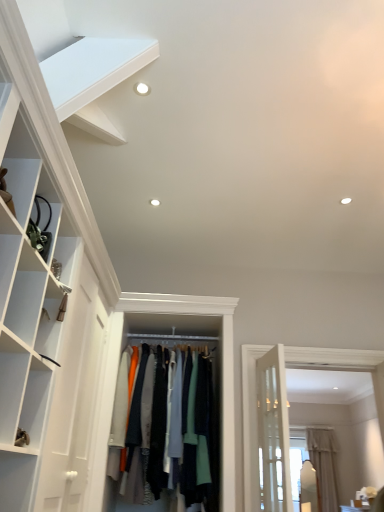
Locate an element on the screen. Image resolution: width=384 pixels, height=512 pixels. knit fabric sweater at center is located at coordinates (195, 431).

This screenshot has width=384, height=512. What are the coordinates of `white matte shelf at upper left` in the screenshot? It's located at (93, 79).

The width and height of the screenshot is (384, 512). What are the coordinates of `knit fabric sweater at center` in the screenshot? It's located at (195, 431).

Is beige fabric curtain at right at the left side of white matte shelf at upper left?

No.

Is point (336, 483) more distant than point (86, 61)?

Yes, point (336, 483) is farther from viewer.

Would you say beige fabric curtain at right contains white matte shelf at upper left?

That's incorrect, white matte shelf at upper left is not inside beige fabric curtain at right.

Between beige fabric curtain at right and white matte shelf at upper left, which one is positioned behind?

beige fabric curtain at right is more distant.

From the image's perspective, between white matte shelf at upper left and beige fabric curtain at right, which one is located above?

From the image's view, white matte shelf at upper left is above.

Where is `curtain behind the white matte shelf at upper left`? curtain behind the white matte shelf at upper left is located at coordinates (324, 466).

Considering the sizes of white matte shelf at upper left and beige fabric curtain at right in the image, is white matte shelf at upper left taller or shorter than beige fabric curtain at right?

Clearly, white matte shelf at upper left is shorter compared to beige fabric curtain at right.

From a real-world perspective, which is physically below, knit fabric sweater at center or beige fabric curtain at right?

From a 3D spatial view, beige fabric curtain at right is below.

Does knit fabric sweater at center have a larger size compared to beige fabric curtain at right?

Yes, knit fabric sweater at center is bigger than beige fabric curtain at right.

Consider the image. Which of these two, knit fabric sweater at center or beige fabric curtain at right, is thinner?

With smaller width is beige fabric curtain at right.

Measure the distance between knit fabric sweater at center and beige fabric curtain at right.

A distance of 4.34 meters exists between knit fabric sweater at center and beige fabric curtain at right.

Which is closer to the camera, (121, 74) or (194, 409)?

Point (121, 74) is positioned closer to the camera compared to point (194, 409).

Considering the relative sizes of white matte shelf at upper left and knit fabric sweater at center in the image provided, is white matte shelf at upper left taller than knit fabric sweater at center?

In fact, white matte shelf at upper left may be shorter than knit fabric sweater at center.

Based on the photo, is white matte shelf at upper left looking in the opposite direction of knit fabric sweater at center?

No, white matte shelf at upper left is not facing the opposite direction of knit fabric sweater at center.

Is beige fabric curtain at right next to knit fabric sweater at center?

No, beige fabric curtain at right is not next to knit fabric sweater at center.

At what (x,y) coordinates should I click in order to perform the action: click on curtain below the knit fabric sweater at center (from a real-world perspective). Please return your answer as a coordinate pair (x, y). This screenshot has height=512, width=384. Looking at the image, I should click on (324, 466).

Considering the sizes of beige fabric curtain at right and knit fabric sweater at center in the image, is beige fabric curtain at right wider or thinner than knit fabric sweater at center?

beige fabric curtain at right is thinner than knit fabric sweater at center.

Is point (329, 501) positioned in front of point (167, 364)?

That is False.

Can you see knit fabric sweater at center touching white matte shelf at upper left?

No, knit fabric sweater at center is not beside white matte shelf at upper left.

Does knit fabric sweater at center have a greater width compared to white matte shelf at upper left?

Yes, knit fabric sweater at center is wider than white matte shelf at upper left.

In the scene shown: Can you confirm if knit fabric sweater at center is smaller than white matte shelf at upper left?

No.

In the image, there is a white matte shelf at upper left. Identify the location of curtain below it (from a real-world perspective). (324, 466).

At what (x,y) coordinates should I click in order to perform the action: click on stairs above the beige fabric curtain at right (from a real-world perspective). Please return your answer as a coordinate pair (x, y). Looking at the image, I should click on (93, 79).

Estimate the real-world distances between objects in this image. Which object is closer to beige fabric curtain at right, white matte shelf at upper left or knit fabric sweater at center?

Among the two, knit fabric sweater at center is located nearer to beige fabric curtain at right.

Which object lies nearer to the anchor point white matte shelf at upper left, knit fabric sweater at center or beige fabric curtain at right?

knit fabric sweater at center is positioned closer to the anchor white matte shelf at upper left.

Looking at the image, which one is located further to beige fabric curtain at right, knit fabric sweater at center or white matte shelf at upper left?

Among the two, white matte shelf at upper left is located further to beige fabric curtain at right.

Looking at the image, which one is located closer to knit fabric sweater at center, white matte shelf at upper left or beige fabric curtain at right?

The object closer to knit fabric sweater at center is white matte shelf at upper left.

Estimate the real-world distances between objects in this image. Which object is closer to knit fabric sweater at center, beige fabric curtain at right or white matte shelf at upper left?

white matte shelf at upper left is closer to knit fabric sweater at center.

Estimate the real-world distances between objects in this image. Which object is closer to white matte shelf at upper left, beige fabric curtain at right or knit fabric sweater at center?

knit fabric sweater at center.

At what (x,y) coordinates should I click in order to perform the action: click on clothing located between white matte shelf at upper left and beige fabric curtain at right in the depth direction. Please return your answer as a coordinate pair (x, y). This screenshot has height=512, width=384. Looking at the image, I should click on (195, 431).